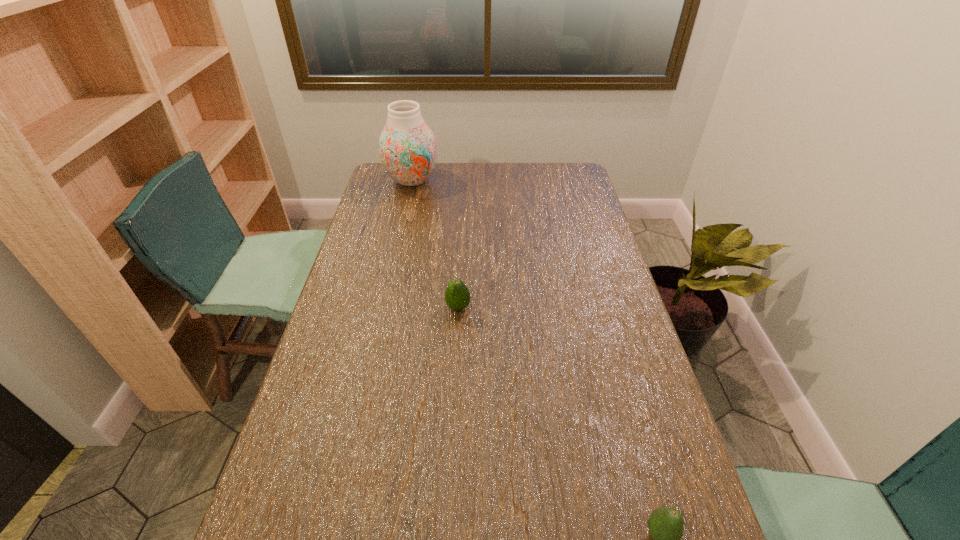
At what (x,y) coordinates should I click in order to perform the action: click on the leftmost object. Please return your answer as a coordinate pair (x, y). The height and width of the screenshot is (540, 960). Looking at the image, I should click on (407, 146).

Image resolution: width=960 pixels, height=540 pixels. Identify the location of the tallest object. (407, 146).

Where is `the second farthest object`? Image resolution: width=960 pixels, height=540 pixels. the second farthest object is located at coordinates (457, 295).

In order to click on the taller avocado in this screenshot , I will do `click(457, 295)`.

You are a GUI agent. You are given a task and a screenshot of the screen. Output one action in this format:
    pyautogui.click(x=<x>, y=<y>)
    Task: Click on the free space located 0.100m on the right of the tallest object
    Image resolution: width=960 pixels, height=540 pixels.
    Given the screenshot: What is the action you would take?
    pyautogui.click(x=463, y=180)

I want to click on vacant area situated on the left of the taller avocado, so click(389, 308).

You are a GUI agent. You are given a task and a screenshot of the screen. Output one action in this format:
    pyautogui.click(x=<x>, y=<y>)
    Task: Click on the object located in the far edge section of the desktop
    The width and height of the screenshot is (960, 540).
    Given the screenshot: What is the action you would take?
    pyautogui.click(x=407, y=146)

Locate an element on the screen. Image resolution: width=960 pixels, height=540 pixels. object situated at the left edge is located at coordinates (407, 146).

The height and width of the screenshot is (540, 960). Find the location of `object that is at the far left corner`. object that is at the far left corner is located at coordinates (407, 146).

Locate an element on the screen. free space at the far edge of the desktop is located at coordinates (421, 190).